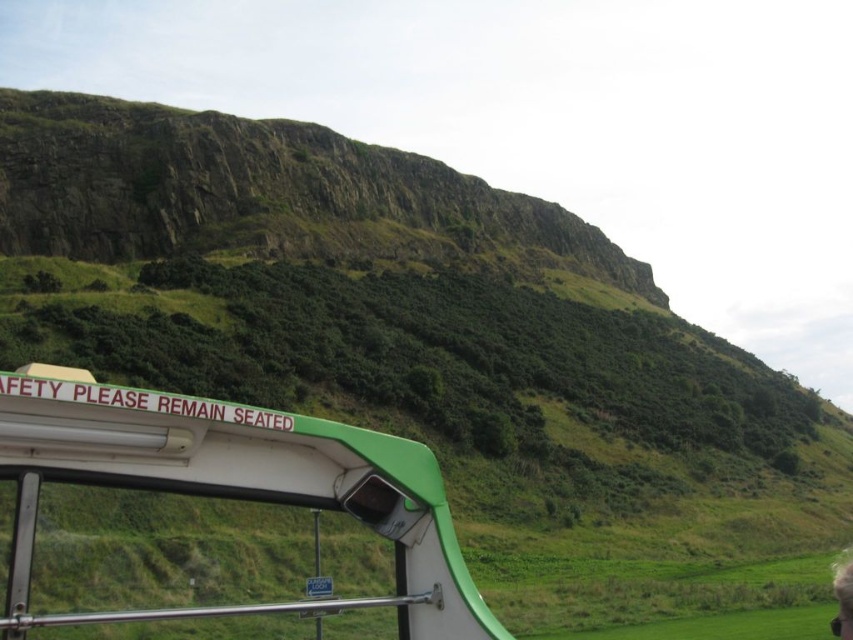
Looking at this image, can you confirm if green plastic tour bus at lower left is bigger than smooth skin person at lower right?

Yes.

Is green plastic tour bus at lower left wider than smooth skin person at lower right?

Yes, green plastic tour bus at lower left is wider than smooth skin person at lower right.

Image resolution: width=853 pixels, height=640 pixels. Identify the location of green plastic tour bus at lower left. (234, 486).

The width and height of the screenshot is (853, 640). I want to click on green plastic tour bus at lower left, so click(x=234, y=486).